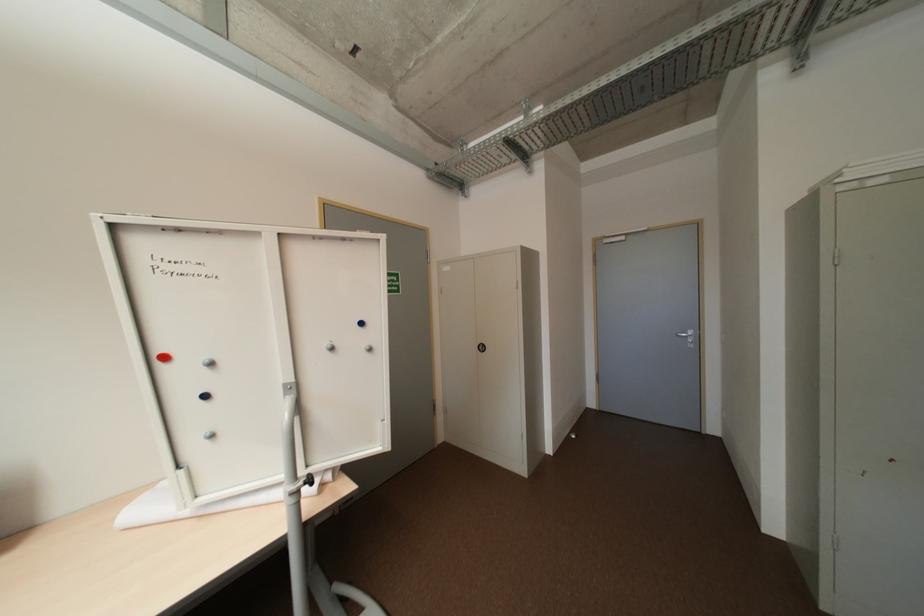
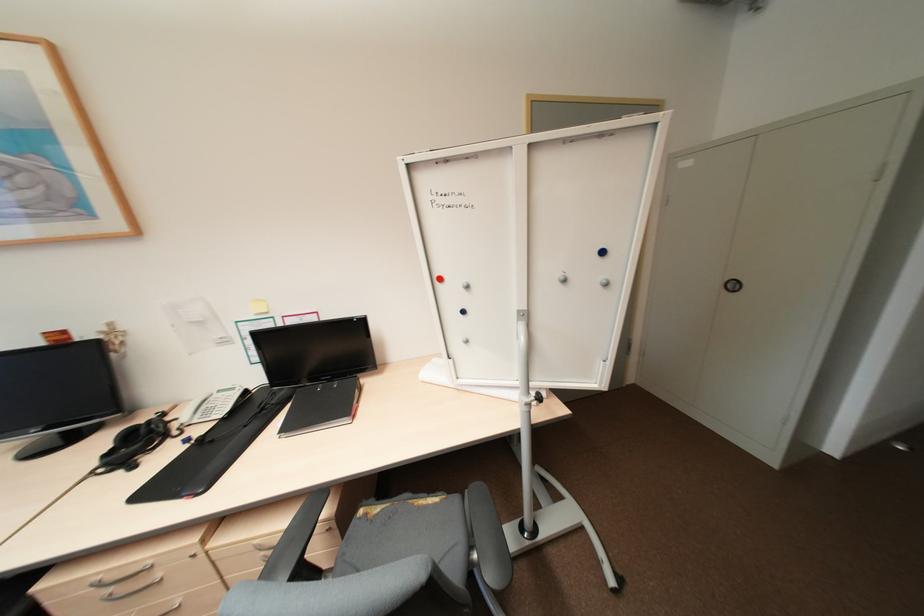
In the second image, find the point that corresponds to point 298,500 in the first image.

(531, 408)